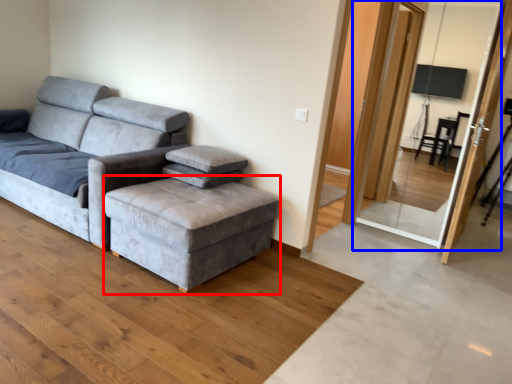
Question: Which of the following is the farthest to the observer, stool (highlighted by a red box) or screen door (highlighted by a blue box)?

Choices:
 (A) stool
 (B) screen door

Answer: (B)